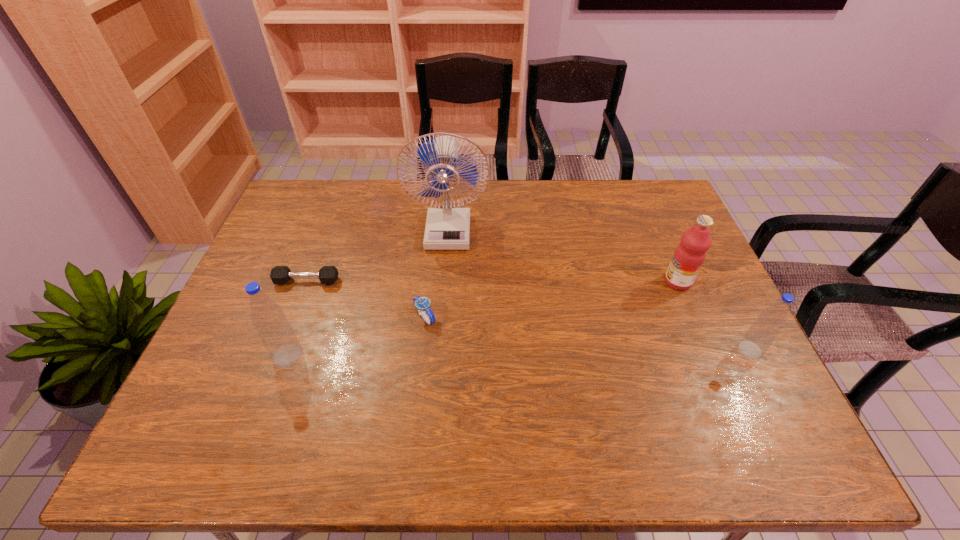
This screenshot has width=960, height=540. What are the coordinates of `free space between the left water bottle and the third nearest object` in the screenshot? It's located at (356, 336).

This screenshot has height=540, width=960. What are the coordinates of `empty space that is in between the shorter water bottle and the farthest object` in the screenshot? It's located at (599, 290).

You are a GUI agent. You are given a task and a screenshot of the screen. Output one action in this format:
    pyautogui.click(x=<x>, y=<y>)
    Task: Click on the free space between the third nearest object and the right water bottle
    
    Given the screenshot: What is the action you would take?
    pyautogui.click(x=588, y=334)

Identify the location of free point between the right water bottle and the dumbbell. (528, 315).

Where is `vacant space in between the second object from right to left and the shorter water bottle`? The height and width of the screenshot is (540, 960). vacant space in between the second object from right to left and the shorter water bottle is located at coordinates (714, 316).

The height and width of the screenshot is (540, 960). I want to click on free space between the fruit juice and the taller water bottle, so click(x=483, y=319).

Identify which object is located as the fifth nearest to the fifth object from left to right. Please provide its 2D coordinates. Your answer should be formatted as a tuple, i.e. [(x, y)], where the tuple contains the x and y coordinates of a point satisfying the conditions above.

[(275, 332)]

Where is `the second closest object to the fruit juice`? This screenshot has width=960, height=540. the second closest object to the fruit juice is located at coordinates (448, 227).

The image size is (960, 540). I want to click on free spot that satisfies the following two spatial constraints: 1. on the front side of the dumbbell; 2. on the left side of the watch, so click(x=294, y=317).